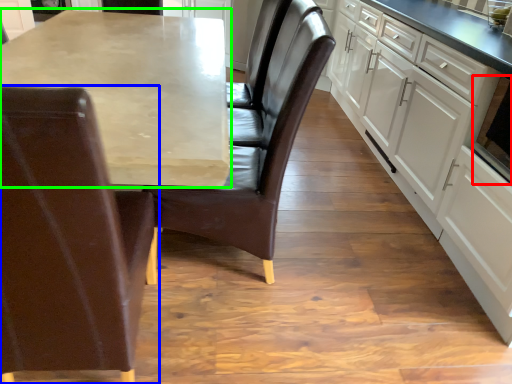
Question: Which is nearer to the appliance (highlighted by a red box)? chair (highlighted by a blue box) or countertop (highlighted by a green box).

Choices:
 (A) chair
 (B) countertop

Answer: (B)